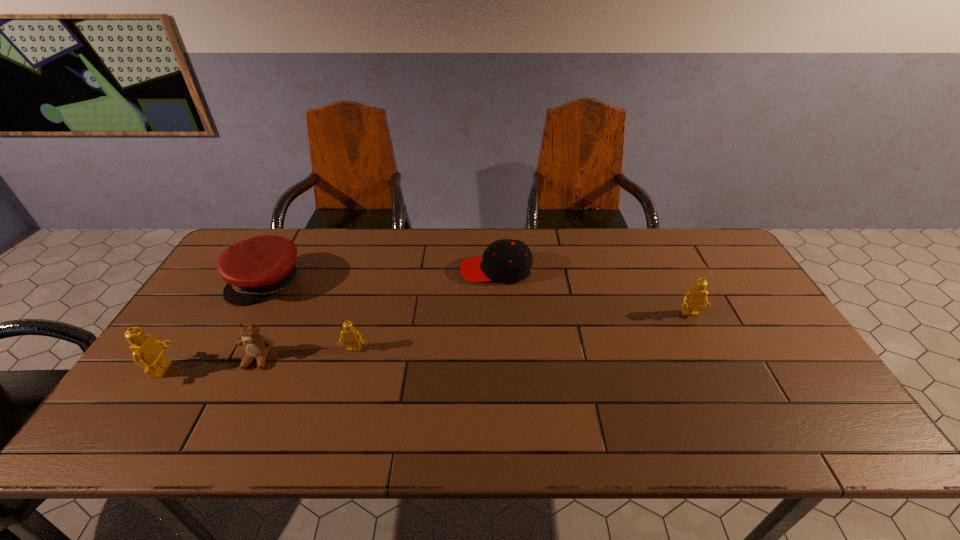
Image resolution: width=960 pixels, height=540 pixels. In order to click on Lego that stands as the third closest to the right cap in this screenshot , I will do `click(147, 351)`.

The height and width of the screenshot is (540, 960). I want to click on vacant area that satisfies the following two spatial constraints: 1. on the front-facing side of the fifth object from left to right; 2. on the face of the shortest Lego, so click(x=499, y=349).

At what (x,y) coordinates should I click in order to perform the action: click on vacant space that satisfies the following two spatial constraints: 1. on the front-facing side of the teddy bear; 2. on the face of the tallest Lego. Please return your answer as a coordinate pair (x, y). This screenshot has height=540, width=960. Looking at the image, I should click on (252, 370).

Where is `blank area in the image that satisfies the following two spatial constraints: 1. on the face of the shortest Lego; 2. on the face of the tallest object`? blank area in the image that satisfies the following two spatial constraints: 1. on the face of the shortest Lego; 2. on the face of the tallest object is located at coordinates (348, 370).

Identify the location of free spot that satisfies the following two spatial constraints: 1. on the face of the second tallest Lego; 2. on the face of the tallest Lego. The height and width of the screenshot is (540, 960). (717, 370).

Identify the location of free spot that satisfies the following two spatial constraints: 1. on the face of the shortest Lego; 2. on the face of the tallest Lego. This screenshot has height=540, width=960. (348, 370).